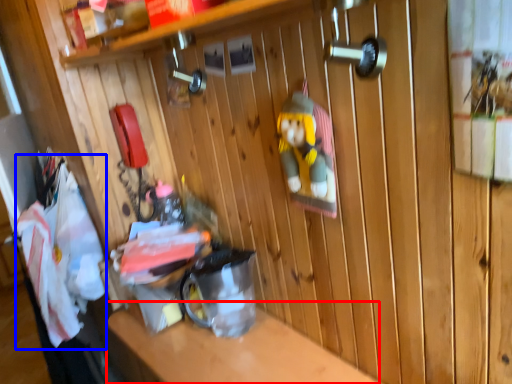
Question: Which of the following is the farthest to the observer, counter top (highlighted by a red box) or laundry (highlighted by a blue box)?

Choices:
 (A) counter top
 (B) laundry

Answer: (B)